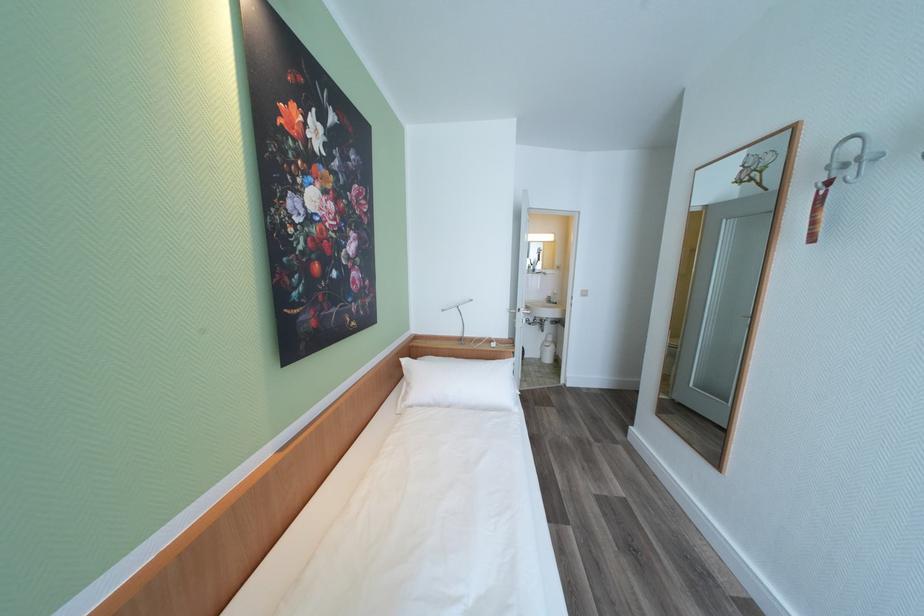
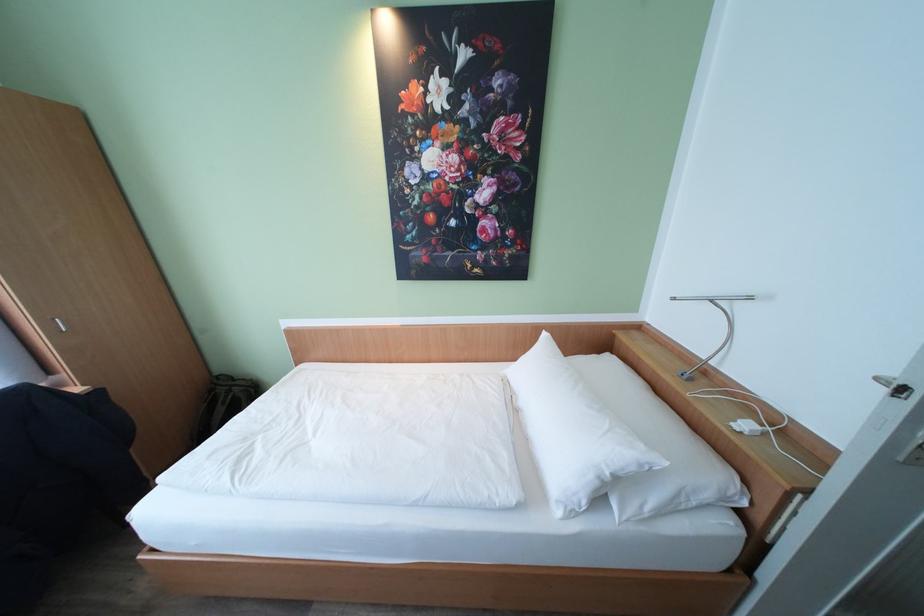
Locate, in the second image, the point that corresponds to the point at 451,312 in the first image.

(681, 300)